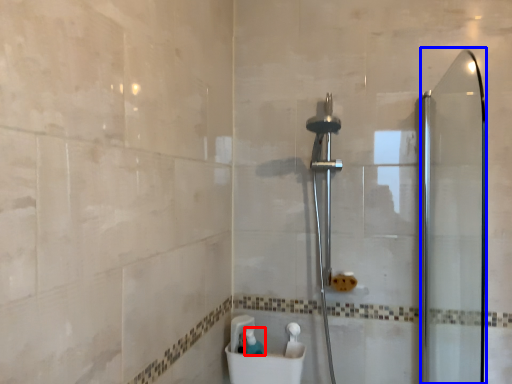
Question: Among these objects, which one is farthest to the camera, toiletry (highlighted by a red box) or screen door (highlighted by a blue box)?

Choices:
 (A) toiletry
 (B) screen door

Answer: (A)